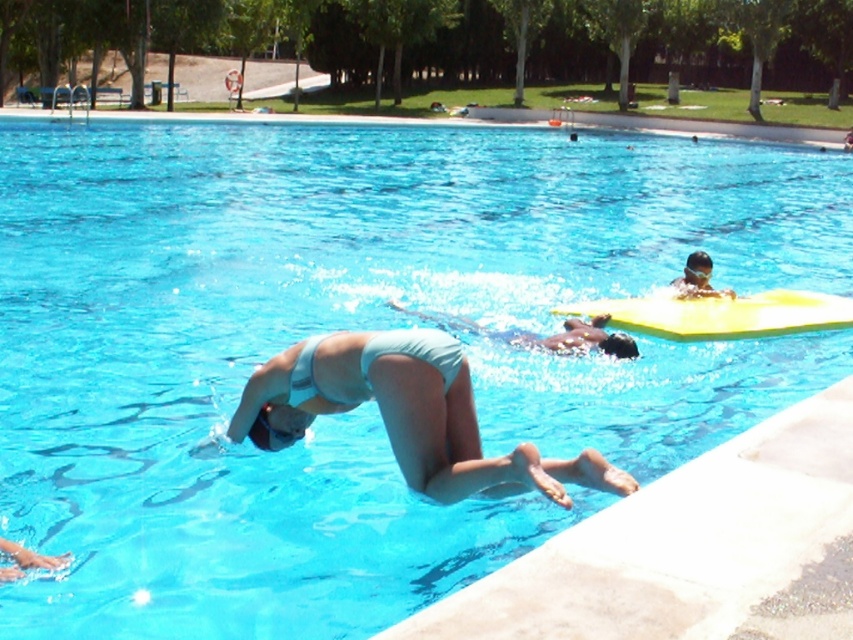
Which is behind, point (242, 435) or point (619, 352)?

Point (619, 352)

The width and height of the screenshot is (853, 640). What do you see at coordinates (407, 417) in the screenshot?
I see `light blue fabric bikini at center` at bounding box center [407, 417].

Where is `light blue fabric bikini at center`? The image size is (853, 640). light blue fabric bikini at center is located at coordinates click(x=407, y=417).

Who is more forward, [416,330] or [694,292]?

Positioned in front is point [416,330].

The height and width of the screenshot is (640, 853). What do you see at coordinates (407, 417) in the screenshot?
I see `light blue fabric bikini at center` at bounding box center [407, 417].

Is point (432, 481) positioned behind point (703, 252)?

No, (432, 481) is in front of (703, 252).

Identify the location of light blue fabric bikini at center. (407, 417).

Who is more distant from viewer, (514,333) or (688,266)?

The point (688,266) is more distant.

Does light blue fabric swimmer at center have a greater height compared to matte blue swim cap at upper right?

Yes, light blue fabric swimmer at center is taller than matte blue swim cap at upper right.

Is point (554, 333) positioned in front of point (700, 262)?

Yes, point (554, 333) is closer to viewer.

You are a GUI agent. You are given a task and a screenshot of the screen. Output one action in this format:
    pyautogui.click(x=<x>, y=<y>)
    Task: Click on the light blue fabric swimmer at center
    Image resolution: width=853 pixels, height=640 pixels.
    Given the screenshot: What is the action you would take?
    click(544, 337)